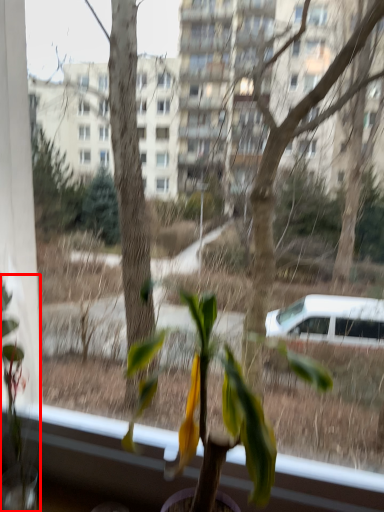
Question: From the image, what is the correct spatial relationship of houseplant (annotated by the red box) in relation to houseplant?

Choices:
 (A) right
 (B) left

Answer: (B)